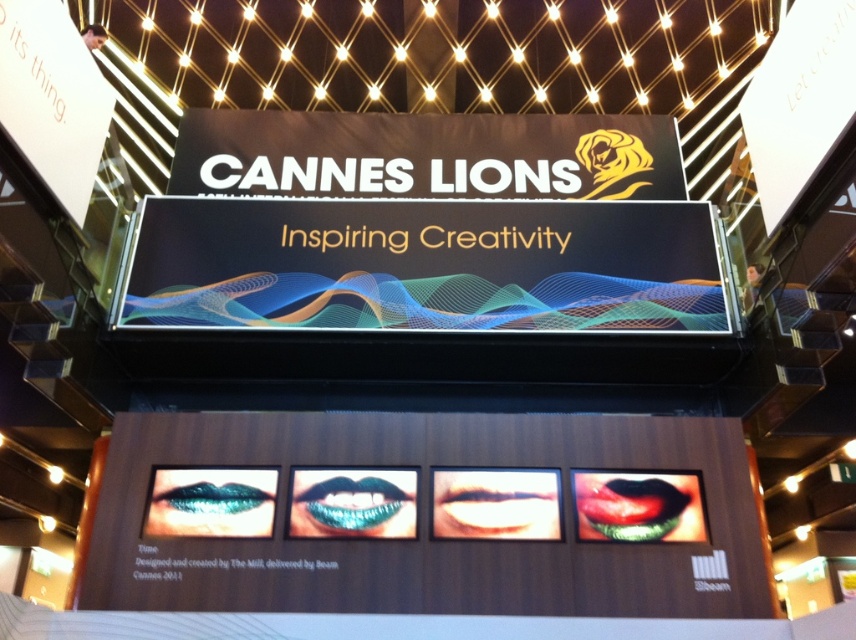
How distant is shiny red lips at center from shiny metallic mouth at center?

34.16 inches

Does shiny red lips at center have a larger size compared to shiny metallic mouth at center?

Yes, shiny red lips at center is bigger than shiny metallic mouth at center.

Which is behind, point (639, 520) or point (522, 518)?

Point (639, 520)

This screenshot has height=640, width=856. Identify the location of shiny red lips at center. [633, 508].

Who is higher up, metallic lips at center or shiny metallic mouth at center?

Positioned higher is shiny metallic mouth at center.

Who is more forward, (94, 548) or (470, 488)?

Point (94, 548)

The width and height of the screenshot is (856, 640). In order to click on metallic lips at center in this screenshot , I will do `click(437, 516)`.

Who is taller, shiny metallic mouth at center or metallic blue lips at center?

shiny metallic mouth at center

Which is in front, point (464, 504) or point (183, 497)?

Positioned in front is point (464, 504).

The height and width of the screenshot is (640, 856). I want to click on shiny metallic mouth at center, so click(x=495, y=506).